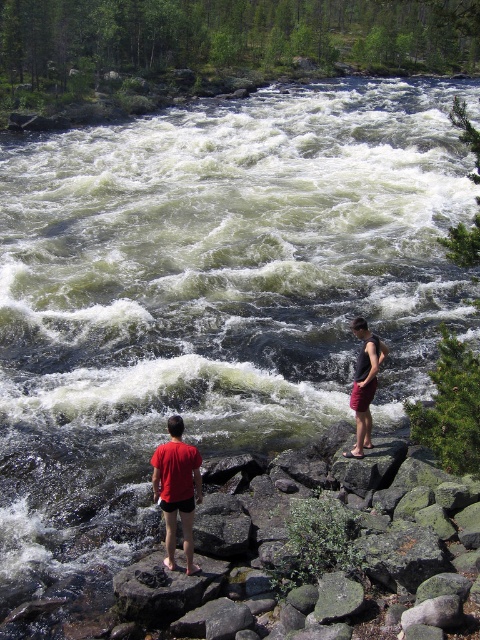
Question: Which object is closer to the camera taking this photo?

Choices:
 (A) dark gray tank top at center
 (B) matte red shorts at lower left

Answer: (B)

Question: From the image, what is the correct spatial relationship of matte red shorts at lower left in relation to red fabric shorts at center?

Choices:
 (A) above
 (B) below

Answer: (B)

Question: Which point is closer to the camera?

Choices:
 (A) (153, 454)
 (B) (369, 339)
 (C) (367, 408)

Answer: (C)

Question: Is red fabric shorts at center positioned in front of dark gray tank top at center?

Choices:
 (A) no
 (B) yes

Answer: (B)

Question: Is matte red shorts at lower left to the left of red fabric shorts at center from the viewer's perspective?

Choices:
 (A) yes
 (B) no

Answer: (A)

Question: Which point is closer to the camera?

Choices:
 (A) (357, 326)
 (B) (180, 456)

Answer: (B)